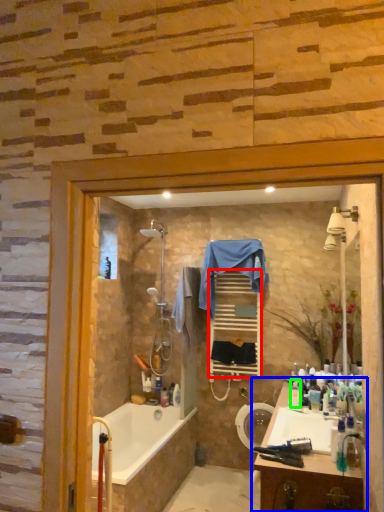
Question: Based on their relative distances, which object is nearer to shelf (highlighted by a red box)? Choose from bathroom cabinet (highlighted by a blue box) and toiletry (highlighted by a green box).

Choices:
 (A) bathroom cabinet
 (B) toiletry

Answer: (B)